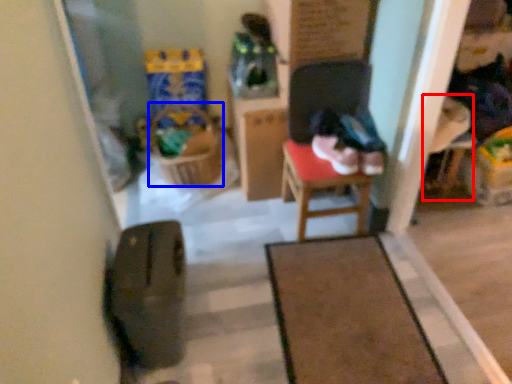
Question: Among these objects, which one is farthest to the camera, armchair (highlighted by a red box) or laundry basket (highlighted by a blue box)?

Choices:
 (A) armchair
 (B) laundry basket

Answer: (B)